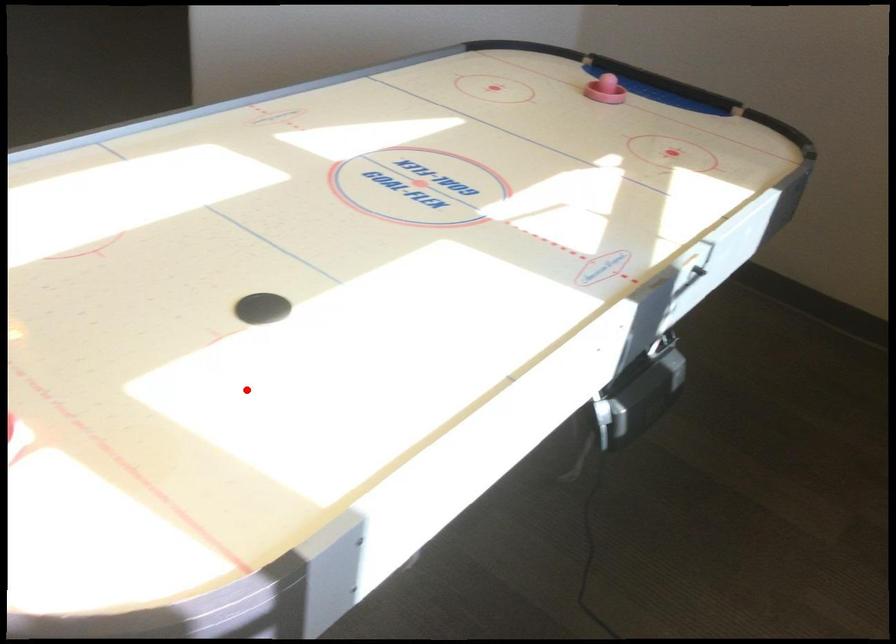
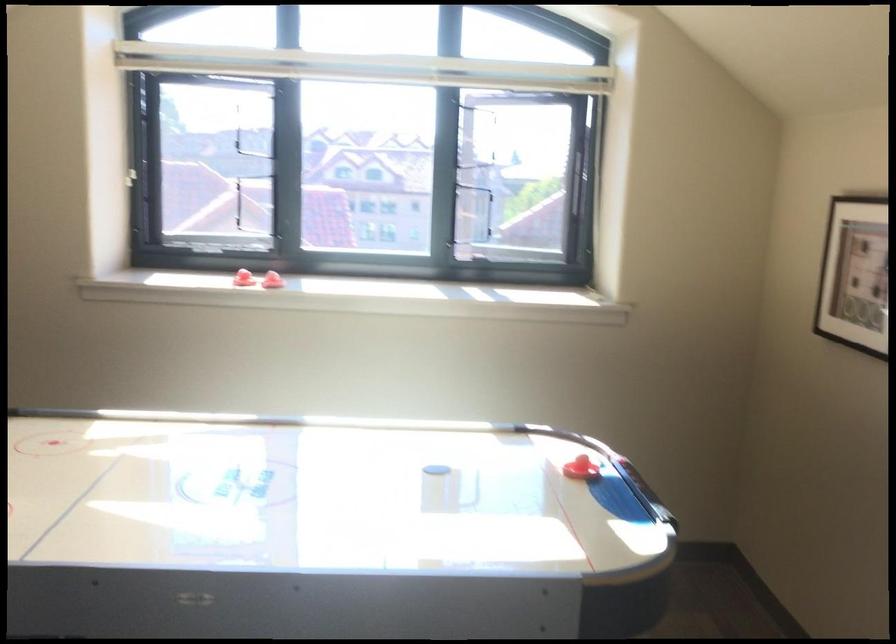
Question: I am providing you with two images of the same scene from different viewpoints. Given a red point in image1, look at the same physical point in image2. Is it:

Choices:
 (A) Closer to the viewpoint
 (B) Farther from the viewpoint

Answer: (B)